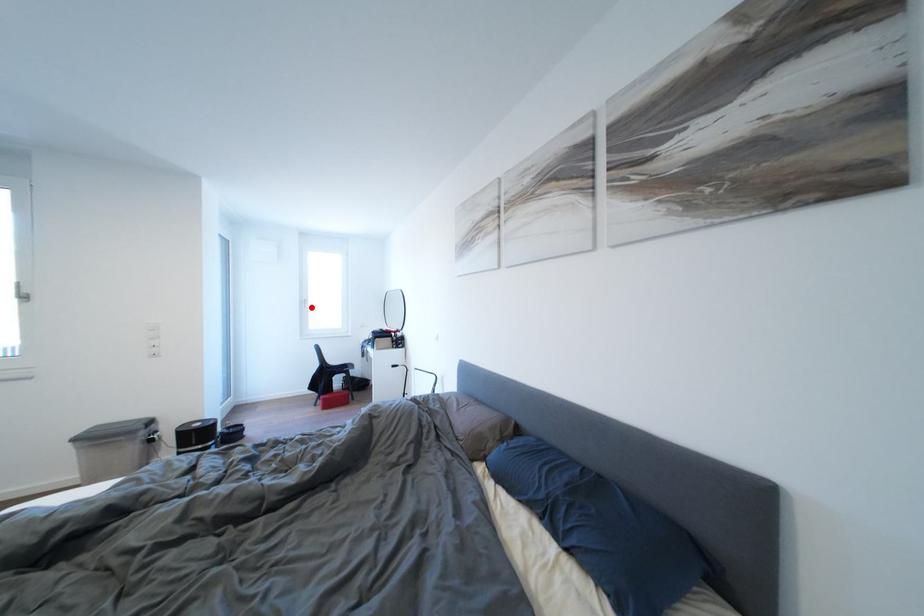
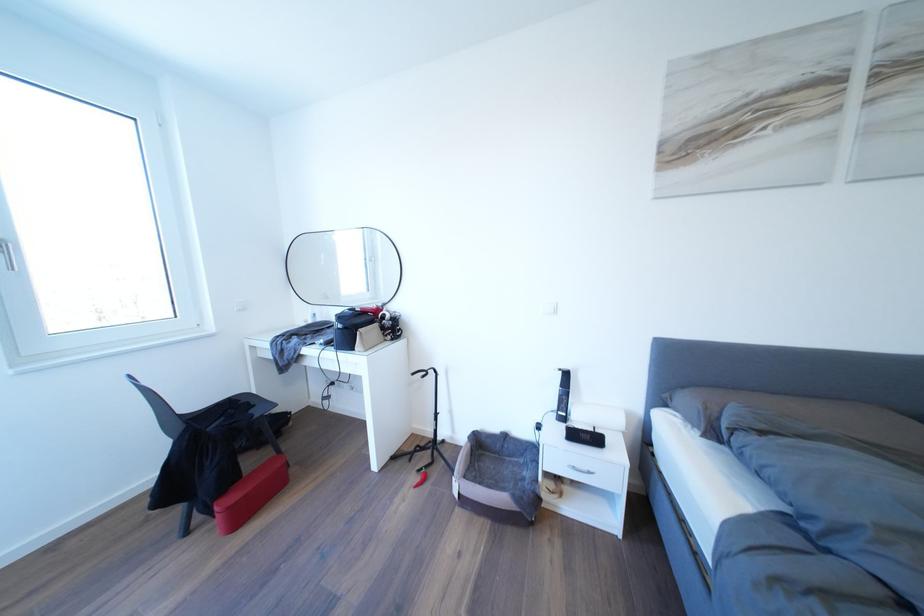
Where in the second image is the point corresponding to the highlighted location from the first image?

(6, 254)